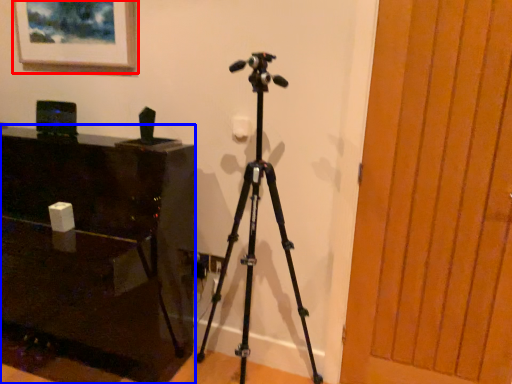
Question: Which object appears farthest to the camera in this image, picture frame (highlighted by a red box) or furniture (highlighted by a blue box)?

Choices:
 (A) picture frame
 (B) furniture

Answer: (A)